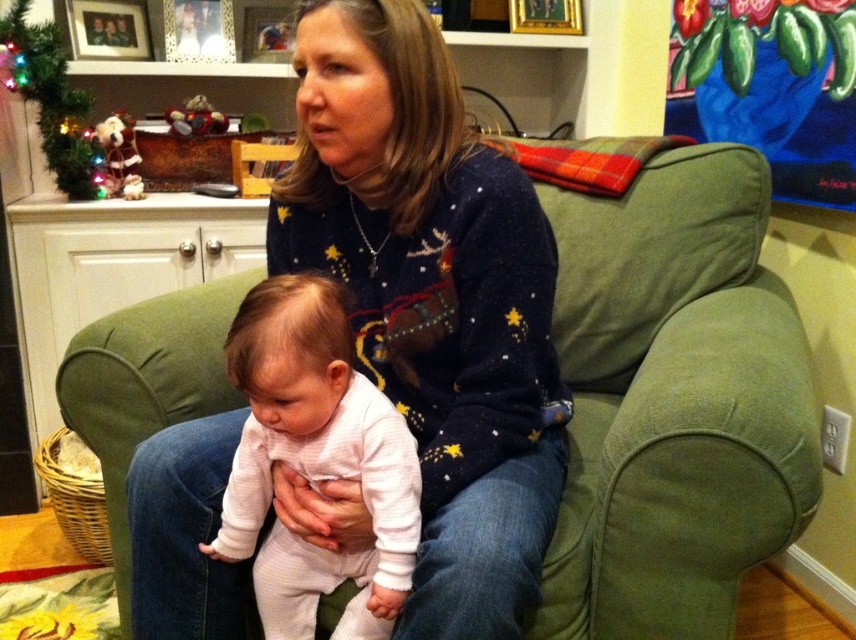
Question: Which point appears farthest from the camera in this image?

Choices:
 (A) (3, 35)
 (B) (635, 486)
 (C) (308, 276)

Answer: (A)

Question: Where is green fabric couch at center located in relation to white soft onesie at center in the image?

Choices:
 (A) above
 (B) below

Answer: (A)

Question: Considering the real-world distances, which object is closest to the green artificial christmas tree at upper left?

Choices:
 (A) green fabric couch at center
 (B) navy sweater at center
 (C) white soft onesie at center

Answer: (B)

Question: Is green fabric couch at center thinner than white soft onesie at center?

Choices:
 (A) yes
 (B) no

Answer: (B)

Question: Which of the following is the closest to the observer?

Choices:
 (A) green fabric couch at center
 (B) navy sweater at center

Answer: (B)

Question: Is navy sweater at center to the right of green fabric couch at center from the viewer's perspective?

Choices:
 (A) no
 (B) yes

Answer: (A)